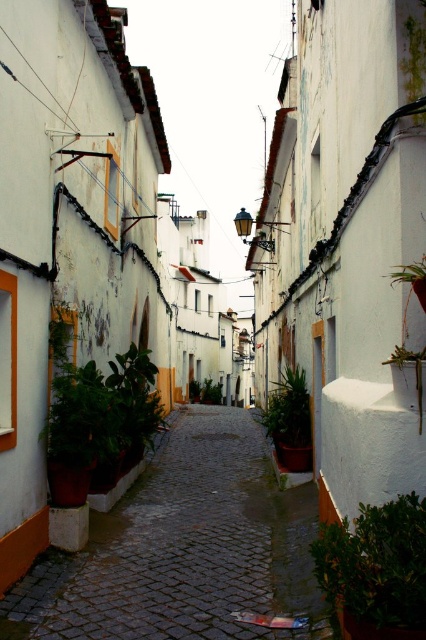
You are a tourist walking along the smooth cobblestone path at center and the green leafy plant at lower right is nearby. Which direction should you walk to reach the plant?

You should walk to the right because the smooth cobblestone path at center is positioned on the left side of the green leafy plant at lower right, meaning the plant is to your right relative to your current position on the path.

You are standing on the cobblestone street and want to water the plants. Which plant, the green leafy plant at lower right or the green leafy plant at center, is closer to you?

The green leafy plant at lower right is closer to the viewer than the green leafy plant at center, so you should water the green leafy plant at lower right first since it is nearer.